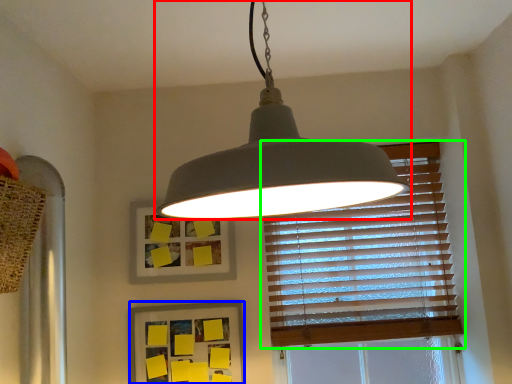
Question: Considering the real-world distances, which object is farthest from lamp (highlighted by a red box)? picture frame (highlighted by a blue box) or window blind (highlighted by a green box)?

Choices:
 (A) picture frame
 (B) window blind

Answer: (A)